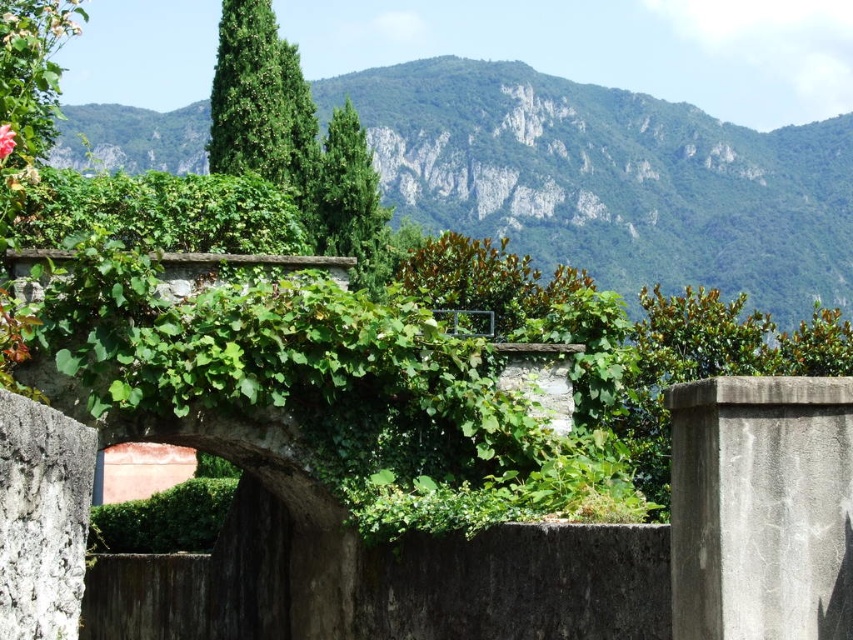
You are standing in a garden with a stone archway covered in vines. You want to take a photo of the green leafy mountain at center. If your camera has a maximum focus range of 200 meters, will it be able to capture the mountain clearly?

The green leafy mountain at center and the camera are 201.60 meters apart. Since the camera can only focus up to 200 meters, it won be able to capture the mountain clearly.